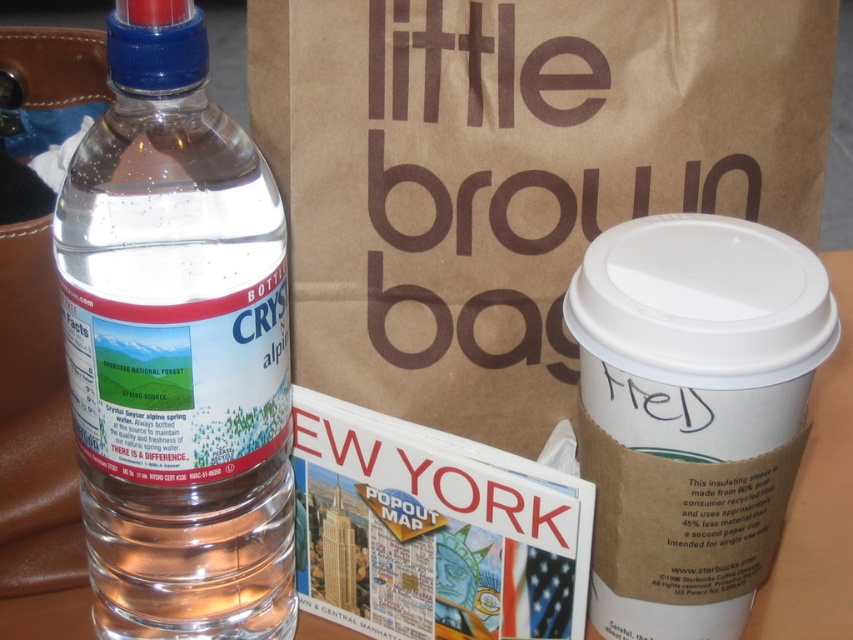
You are a delivery person who needs to place a package on the table. The package is 30 inches long. Can you fit it between the edge of the table and the brown paper bag at upper center?

The distance of brown paper bag at upper center from camera is 29.30 inches. The package is 30 inches long, which is slightly longer than the available space. Therefore, it won not fit between the edge of the table and the brown paper bag at upper center.

You are looking at the table with the Crystal Geyser Alpine Spring water bottle and the disposable coffee cup. Where is the point located at coordinates (511, 173)?

The point at coordinates (511, 173) corresponds to the brown paper bag at upper center.